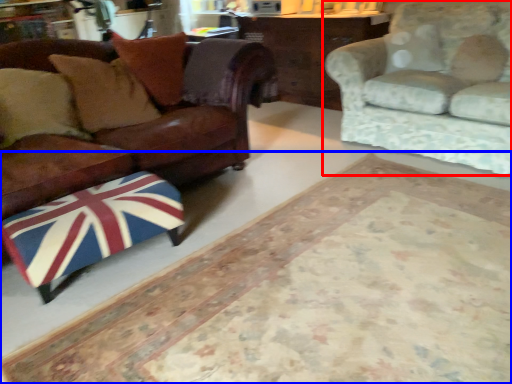
Question: Which of the following is the farthest to the observer, studio couch (highlighted by a red box) or mat (highlighted by a blue box)?

Choices:
 (A) studio couch
 (B) mat

Answer: (A)